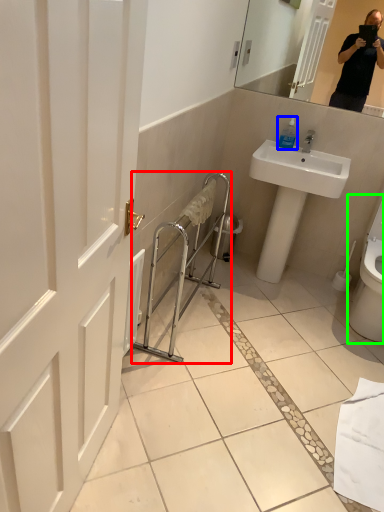
Question: Which is farther away from balustrade (highlighted by a red box)? soap dispenser (highlighted by a blue box) or toilet (highlighted by a green box)?

Choices:
 (A) soap dispenser
 (B) toilet

Answer: (B)